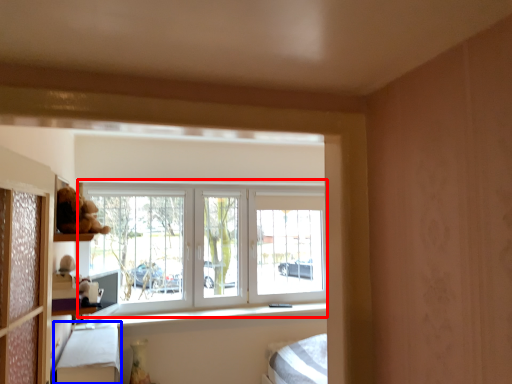
Question: Among these objects, which one is farthest to the camera, window (highlighted by a red box) or bed frame (highlighted by a blue box)?

Choices:
 (A) window
 (B) bed frame

Answer: (A)